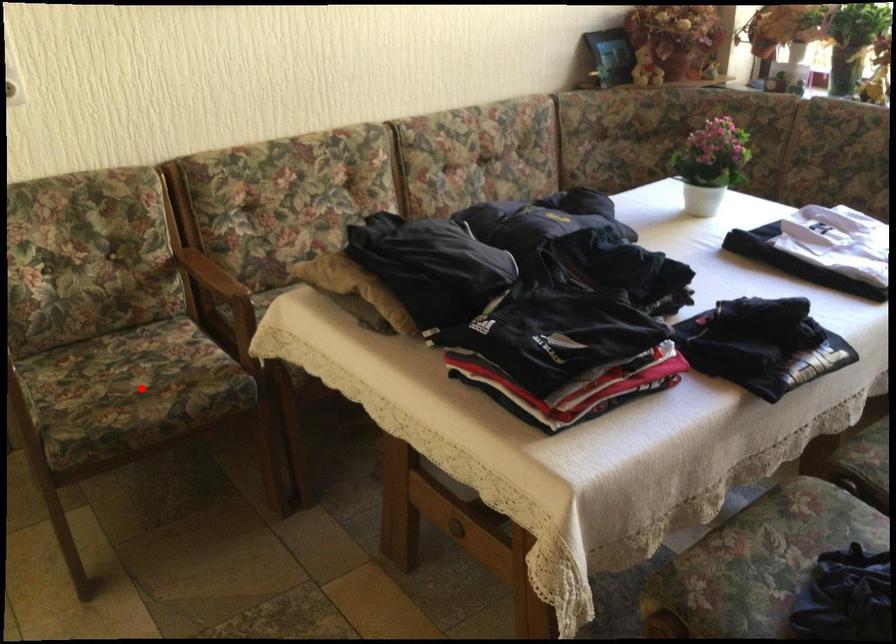
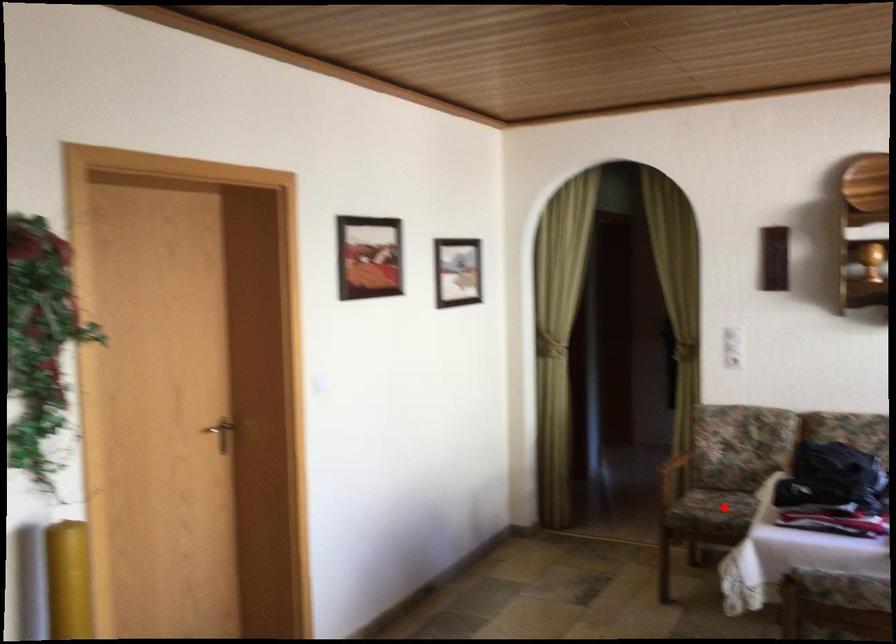
I am providing you with two images of the same scene from different viewpoints. A red point is marked on the first image and another point is marked on the second image. Is the red point in image1 aligned with the point shown in image2?

Yes